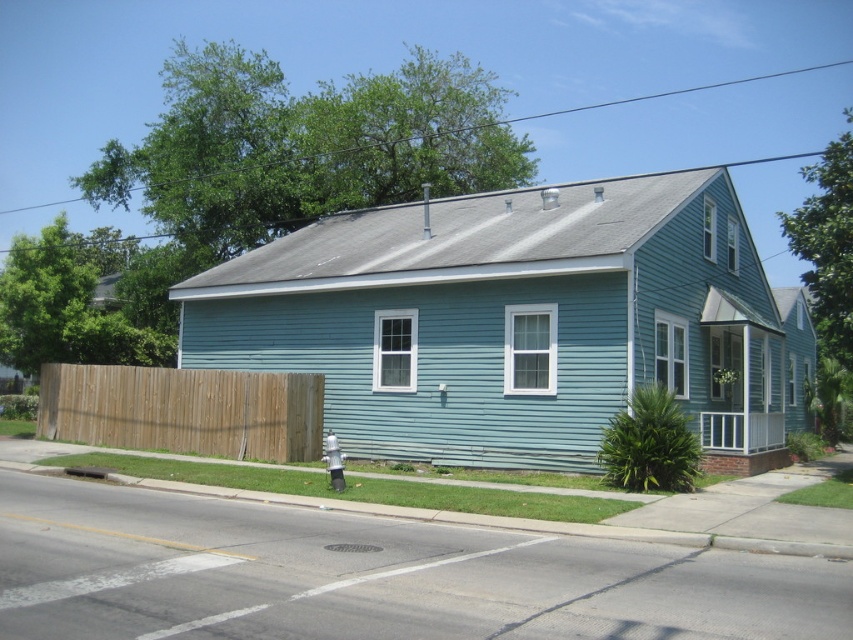
You are a delivery person approaching the house and need to place a package on the ground near the brown wooden fence at lower left. Can you place it directly next to the gray concrete curb at lower center without moving the fence?

The brown wooden fence at lower left is positioned over the gray concrete curb at lower center, meaning the fence is built on top of the curb. Therefore, you cannot place the package directly next to the curb without moving the fence since they are in the same location.

You are standing at the center of the image and want to walk towards the brown wooden fence at lower left. Which direction should you move in?

Since the brown wooden fence at lower left is located at point 0.642 on the x axis and 0.216 on the y axis, you should move towards the lower left direction to reach it.